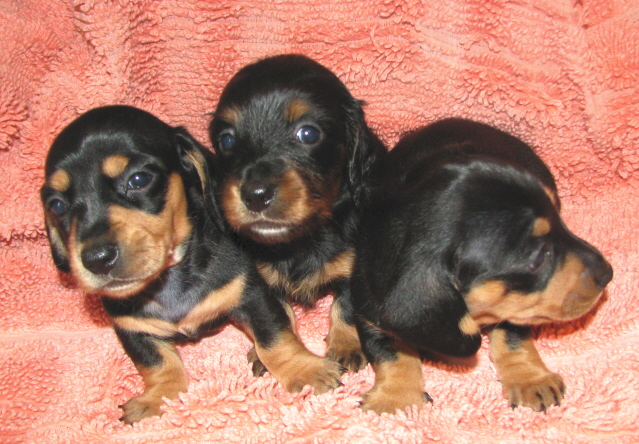
Where is `chest`? The image size is (639, 444). chest is located at coordinates (188, 312), (316, 268).